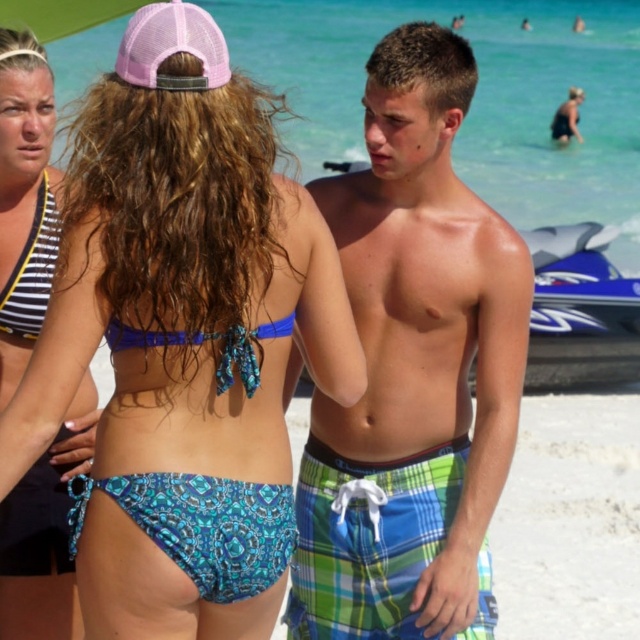
Based on the photo, can you confirm if green plaid shorts at center is thinner than striped fabric bikini top at left?

No, green plaid shorts at center is not thinner than striped fabric bikini top at left.

Who is positioned more to the left, green plaid shorts at center or striped fabric bikini top at left?

Positioned to the left is striped fabric bikini top at left.

Identify the location of green plaid shorts at center. (412, 371).

Is blue printed bikini bottom at center below green plaid shorts at center?

No, blue printed bikini bottom at center is not below green plaid shorts at center.

Can you confirm if blue printed bikini bottom at center is bigger than green plaid shorts at center?

Actually, blue printed bikini bottom at center might be smaller than green plaid shorts at center.

Is point (154, 540) closer to camera compared to point (348, 506)?

Yes, it is.

Where is `blue printed bikini bottom at center`? blue printed bikini bottom at center is located at coordinates (182, 337).

Based on the photo, does blue printed bikini bottom at center appear on the left side of striped fabric bikini top at upper left?

In fact, blue printed bikini bottom at center is to the right of striped fabric bikini top at upper left.

What do you see at coordinates (182, 337) in the screenshot?
I see `blue printed bikini bottom at center` at bounding box center [182, 337].

At what (x,y) coordinates should I click in order to perform the action: click on blue printed bikini bottom at center. Please return your answer as a coordinate pair (x, y). The image size is (640, 640). Looking at the image, I should click on (182, 337).